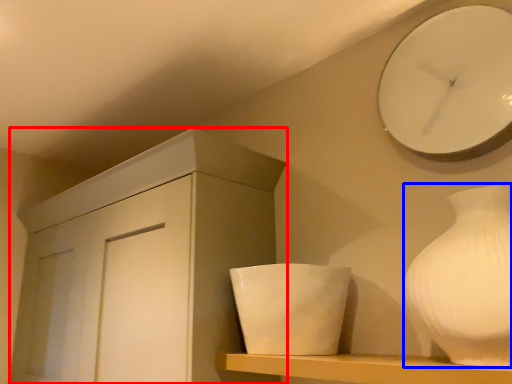
Question: Which object is closer to the camera taking this photo, cabinetry (highlighted by a red box) or vase (highlighted by a blue box)?

Choices:
 (A) cabinetry
 (B) vase

Answer: (B)